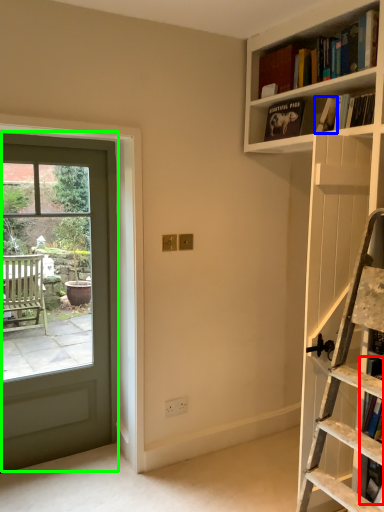
Question: Considering the real-world distances, which object is closest to book (highlighted by a red box)? book (highlighted by a blue box) or door (highlighted by a green box).

Choices:
 (A) book
 (B) door

Answer: (A)